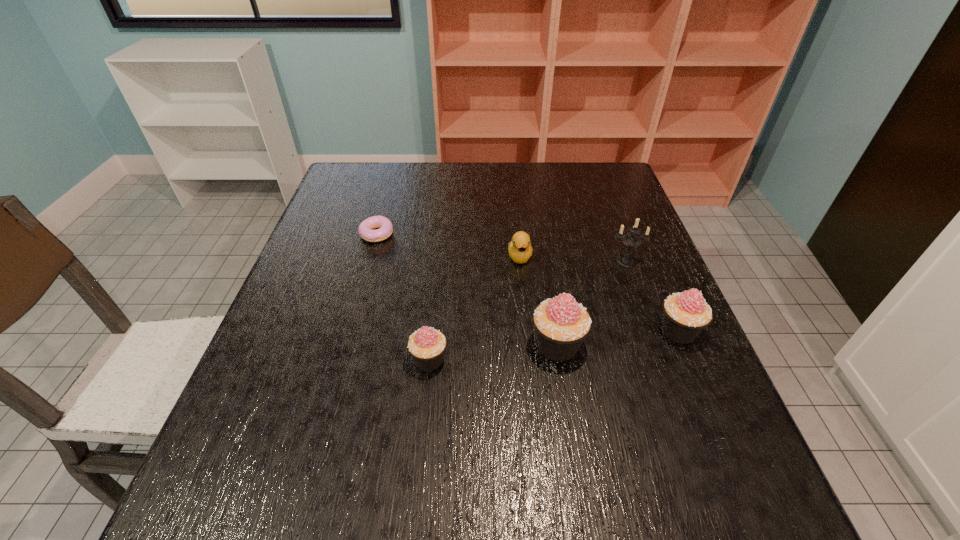
You are a GUI agent. You are given a task and a screenshot of the screen. Output one action in this format:
    pyautogui.click(x=<x>, y=<y>)
    Task: Click on the vacant point at the right edge
    Image resolution: width=960 pixels, height=540 pixels.
    Given the screenshot: What is the action you would take?
    coord(641,238)

You are a GUI agent. You are given a task and a screenshot of the screen. Output one action in this format:
    pyautogui.click(x=<x>, y=<y>)
    Task: Click on the free region at the far left corner
    The image size is (960, 540).
    Given the screenshot: What is the action you would take?
    pyautogui.click(x=389, y=164)

This screenshot has height=540, width=960. In the image, there is a desktop. In order to click on blank space at the near left corner in this screenshot , I will do `click(247, 421)`.

At what (x,y) coordinates should I click in order to perform the action: click on vacant space at the far right corner of the desktop. Please return your answer as a coordinate pair (x, y). The image size is (960, 540). Looking at the image, I should click on (605, 177).

At what (x,y) coordinates should I click in order to perform the action: click on free space between the rightmost cupcake and the tallest cupcake. Please return your answer as a coordinate pair (x, y). The width and height of the screenshot is (960, 540). Looking at the image, I should click on (618, 338).

This screenshot has width=960, height=540. What are the coordinates of `free space that is in between the second object from left to right and the shortest object` in the screenshot? It's located at (402, 297).

Find the location of a particular element. The image size is (960, 540). free space between the second tallest cupcake and the doughnut is located at coordinates (527, 282).

In order to click on free space between the second shortest object and the rightmost cupcake in this screenshot , I will do `click(599, 294)`.

In order to click on vacant area between the second tallest cupcake and the duckling in this screenshot , I will do `click(599, 294)`.

At what (x,y) coordinates should I click in order to perform the action: click on vacant area between the candle holder and the rightmost cupcake. Please return your answer as a coordinate pair (x, y). This screenshot has height=540, width=960. Looking at the image, I should click on (652, 296).